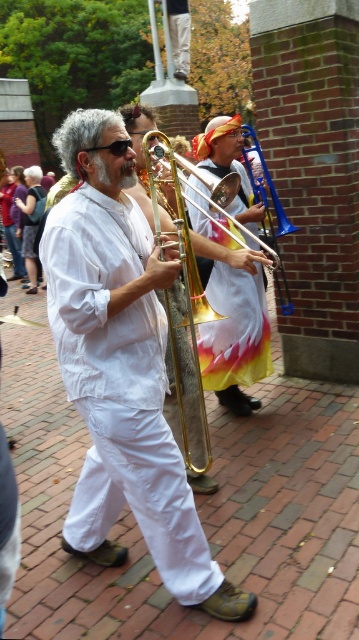
Can you confirm if metallic gold trombone at center is positioned above gold brass trombone at center?

Correct, metallic gold trombone at center is located above gold brass trombone at center.

Can you confirm if metallic gold trombone at center is wider than gold brass trombone at center?

Answer: Correct, the width of metallic gold trombone at center exceeds that of gold brass trombone at center.

You are a GUI agent. You are given a task and a screenshot of the screen. Output one action in this format:
    pyautogui.click(x=<x>, y=<y>)
    Task: Click on the metallic gold trombone at center
    
    Given the screenshot: What is the action you would take?
    pyautogui.click(x=235, y=336)

Can you confirm if white linen robe at center is positioned to the left of gold brass trombone at center?

Yes, white linen robe at center is to the left of gold brass trombone at center.

Which is below, white linen robe at center or gold brass trombone at center?

white linen robe at center

Is point (120, 275) positioned before point (176, 374)?

Yes.

Image resolution: width=359 pixels, height=640 pixels. In order to click on white linen robe at center in this screenshot , I will do `click(119, 388)`.

Can you confirm if white linen robe at center is positioned to the right of metallic gold trombone at center?

In fact, white linen robe at center is to the left of metallic gold trombone at center.

Who is lower down, white linen robe at center or metallic gold trombone at center?

white linen robe at center is lower down.

Which is in front, point (148, 385) or point (229, 208)?

Point (148, 385)

The width and height of the screenshot is (359, 640). I want to click on white linen robe at center, so click(119, 388).